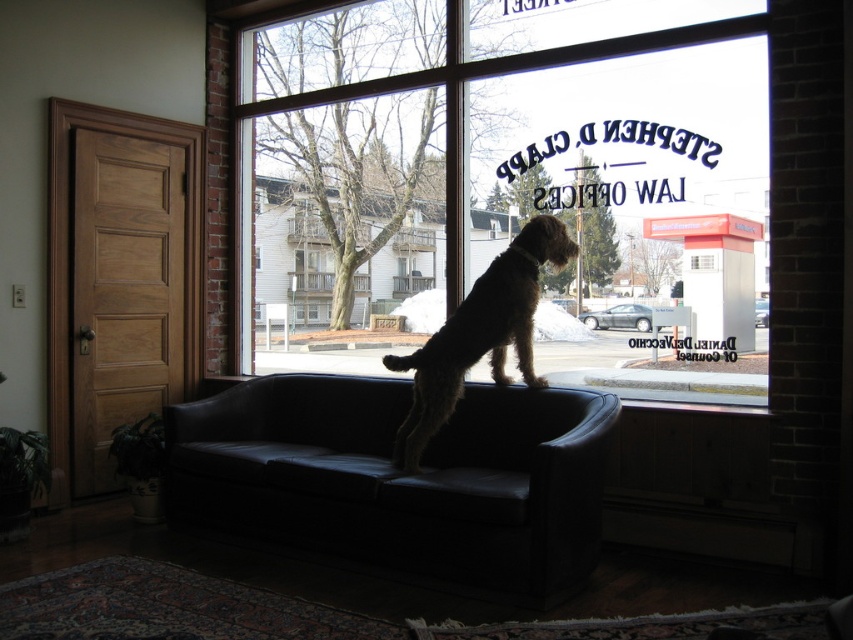
Question: Which point appears farthest from the camera in this image?

Choices:
 (A) (335, 200)
 (B) (531, 499)

Answer: (A)

Question: Does transparent glass window at center lie behind brown textured fur dog at center?

Choices:
 (A) yes
 (B) no

Answer: (A)

Question: Considering the relative positions of transparent glass window at center and brown textured fur dog at center in the image provided, where is transparent glass window at center located with respect to brown textured fur dog at center?

Choices:
 (A) left
 (B) right

Answer: (A)

Question: Among these points, which one is farthest from the camera?

Choices:
 (A) (567, 582)
 (B) (454, 342)

Answer: (B)

Question: Does transparent glass window at center have a greater width compared to brown textured fur dog at center?

Choices:
 (A) yes
 (B) no

Answer: (A)

Question: Which point is closer to the camera?

Choices:
 (A) transparent glass window at center
 (B) brown textured fur dog at center
 (C) black leather couch at center

Answer: (C)